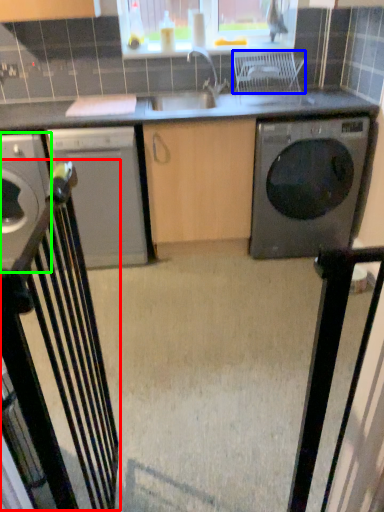
Question: Which is farther away from chair (highlighted by a red box)? chair (highlighted by a blue box) or home appliance (highlighted by a green box)?

Choices:
 (A) chair
 (B) home appliance

Answer: (A)